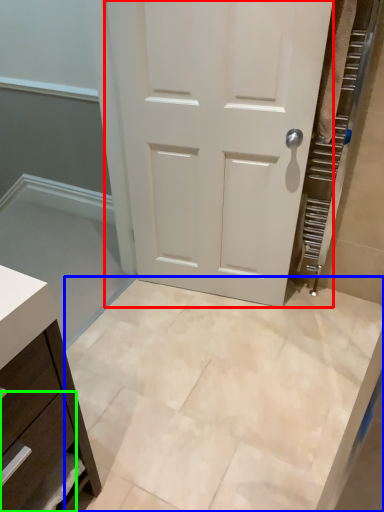
Question: Which is nearer to the door (highlighted by a red box)? ceramic tile (highlighted by a blue box) or drawer (highlighted by a green box).

Choices:
 (A) ceramic tile
 (B) drawer

Answer: (A)